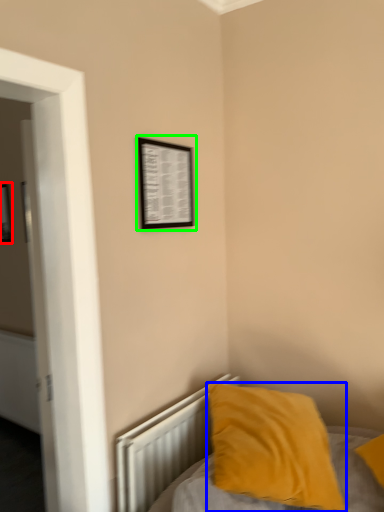
Question: Based on their relative distances, which object is nearer to picture frame (highlighted by a red box)? Choose from pillow (highlighted by a blue box) and picture frame (highlighted by a green box).

Choices:
 (A) pillow
 (B) picture frame

Answer: (B)